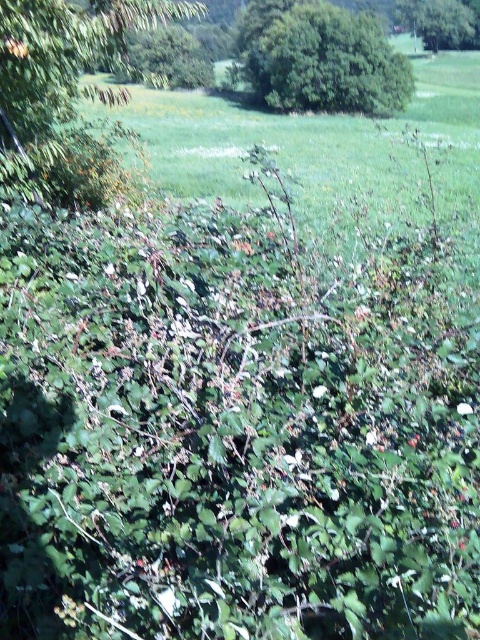
You are a hiker who wants to cross a narrow path between the green leafy bush at upper center and the green leafy tree at upper center. The path is exactly 83.08 feet wide. If your backpack has a width of 2 feet, can you safely pass through the path without touching either the bush or the tree?

The path between the green leafy bush at upper center and the green leafy tree at upper center is 83.08 feet wide. Since your backpack is only 2 feet wide, you can easily pass through the path without any issues as the width is more than sufficient.